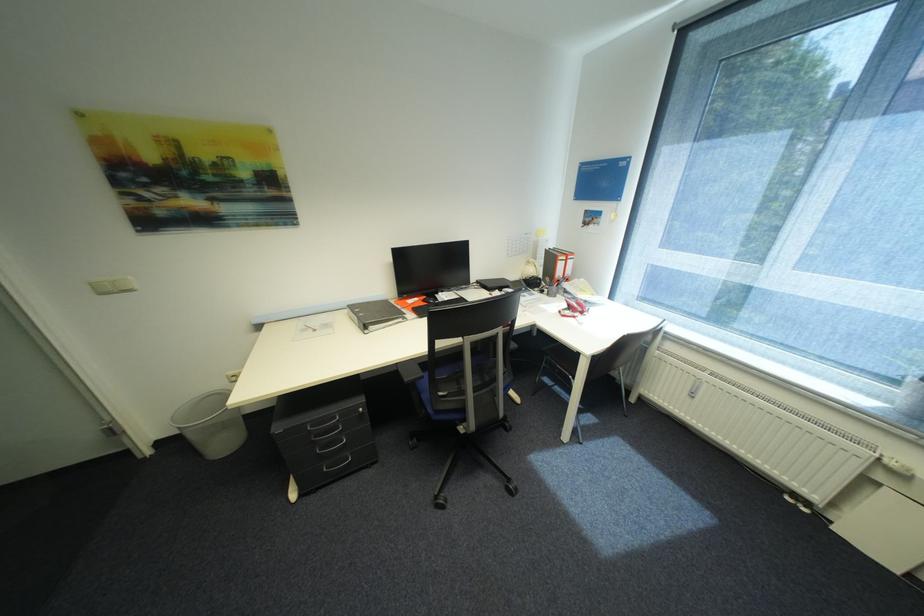
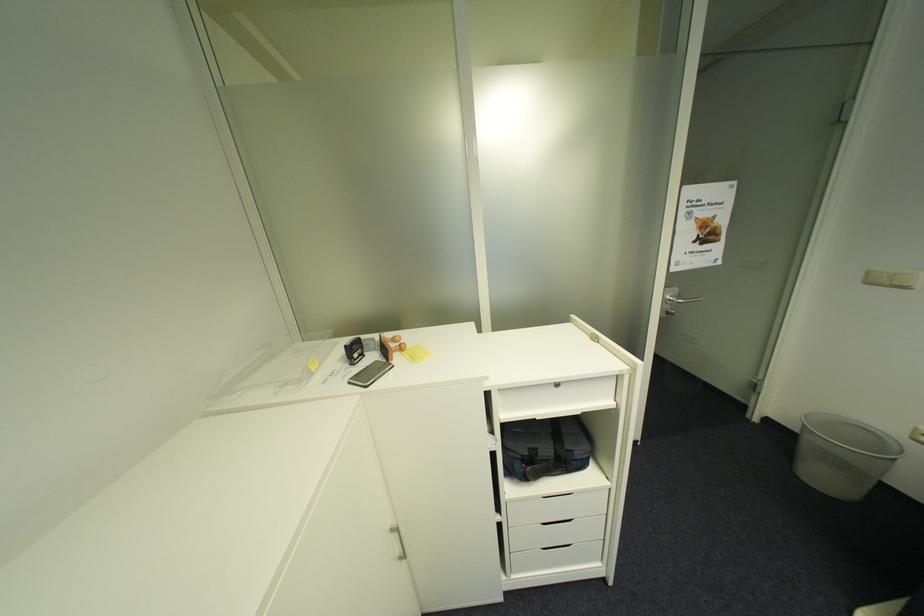
Where in the second image is the point corresponding to point (124, 292) from the first image?

(895, 285)